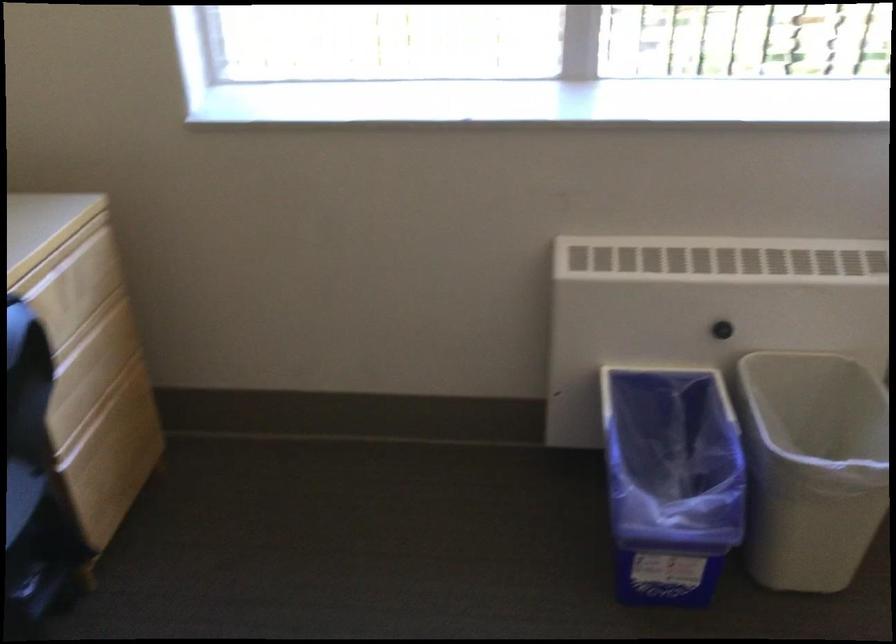
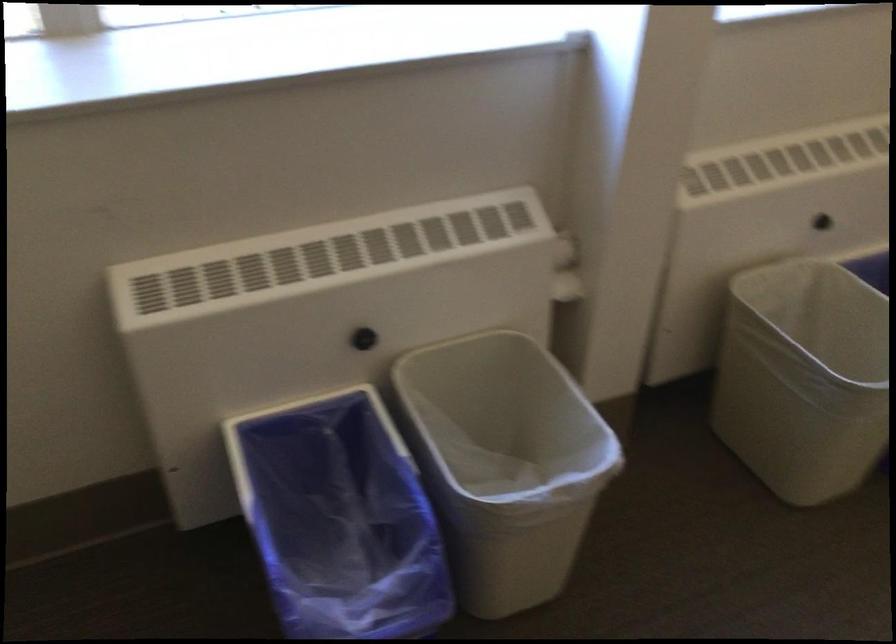
In a continuous first-person perspective shot, in which direction is the camera moving?

The cameraman moved toward right, forward.